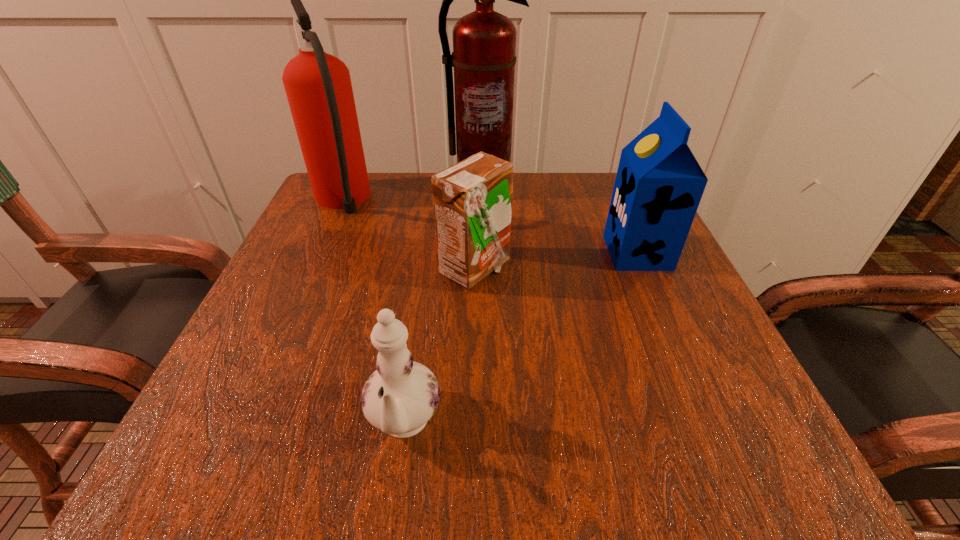
You are a GUI agent. You are given a task and a screenshot of the screen. Output one action in this format:
    pyautogui.click(x=<x>, y=<y>)
    Task: Click on the right fire extinguisher
    
    Given the screenshot: What is the action you would take?
    pyautogui.click(x=484, y=42)

Locate an element on the screen. Image resolution: width=960 pixels, height=540 pixels. the left fire extinguisher is located at coordinates (318, 86).

Find the location of `the taller carton`. the taller carton is located at coordinates (659, 184).

Locate an element on the screen. the third shortest object is located at coordinates (659, 184).

Where is `the shorter carton`? the shorter carton is located at coordinates (472, 200).

The image size is (960, 540). I want to click on chinaware, so click(399, 398).

The image size is (960, 540). What are the coordinates of `free spot located on the side of the right fire extinguisher with the handle and hose` in the screenshot? It's located at (483, 234).

Identify the location of free space located 0.210m with the cap open on the third shortest object. (502, 253).

The width and height of the screenshot is (960, 540). In order to click on free location located 0.110m with the cap open on the third shortest object in this screenshot , I will do `click(553, 253)`.

Identify the location of free spot located with the cap open on the third shortest object. Image resolution: width=960 pixels, height=540 pixels. (427, 253).